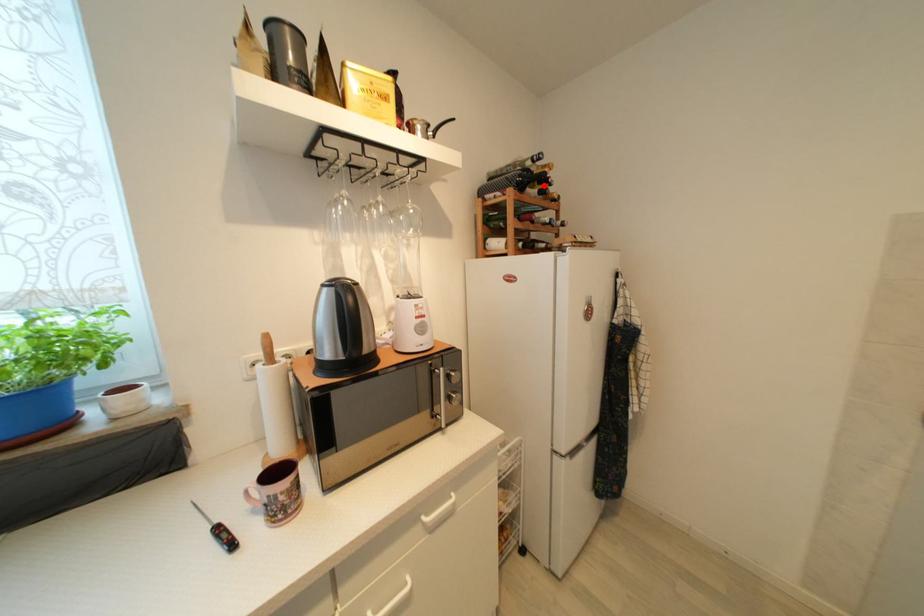
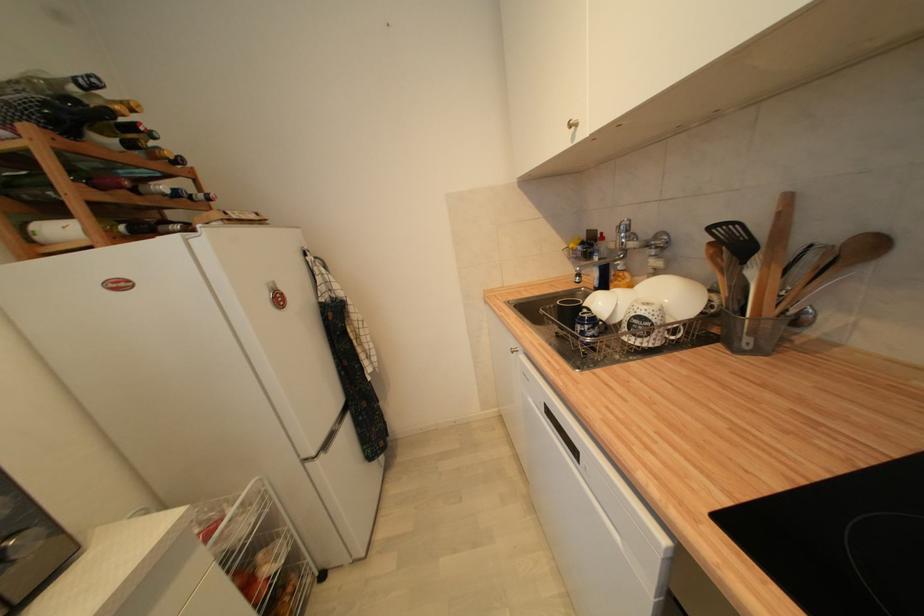
Question: I am providing you with two images of the same scene from different viewpoints. A red point is marked on the first image. Is the red point's position out of view in image 2?

Choices:
 (A) Yes
 (B) No

Answer: (B)